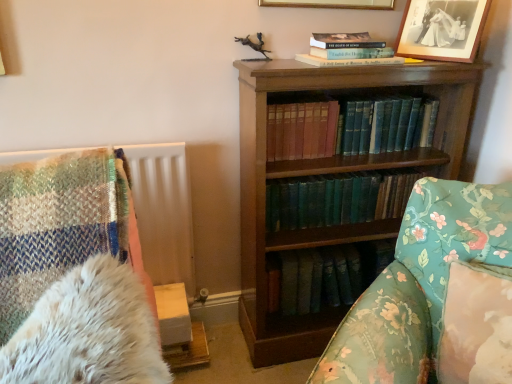
Question: Considering the relative positions of dark green leather bookshelf at center and black matte picture frame at upper right, the second picture frame positioned from the left, in the image provided, is dark green leather bookshelf at center in front of black matte picture frame at upper right, the second picture frame positioned from the left,?

Choices:
 (A) no
 (B) yes

Answer: (B)

Question: From the image's perspective, does dark green leather bookshelf at center appear lower than black matte picture frame at upper right, the second picture frame positioned from the left?

Choices:
 (A) no
 (B) yes

Answer: (B)

Question: Can you confirm if dark green leather bookshelf at center is taller than black matte picture frame at upper right, the first picture frame viewed from the right?

Choices:
 (A) no
 (B) yes

Answer: (B)

Question: Is dark green leather bookshelf at center shorter than black matte picture frame at upper right, the first picture frame viewed from the right?

Choices:
 (A) yes
 (B) no

Answer: (B)

Question: Does dark green leather bookshelf at center touch black matte picture frame at upper right, the first picture frame viewed from the right?

Choices:
 (A) no
 (B) yes

Answer: (A)

Question: Can we say dark green leather bookshelf at center lies outside black matte picture frame at upper right, the second picture frame positioned from the left?

Choices:
 (A) no
 (B) yes

Answer: (B)

Question: Is black matte picture frame at upper right, the first picture frame viewed from the right, facing towards dark green leather bookshelf at center?

Choices:
 (A) no
 (B) yes

Answer: (A)

Question: Is black matte picture frame at upper right, the second picture frame positioned from the left, positioned far away from dark green leather bookshelf at center?

Choices:
 (A) no
 (B) yes

Answer: (A)

Question: Is black matte picture frame at upper right, the second picture frame positioned from the left, bigger than dark green leather bookshelf at center?

Choices:
 (A) yes
 (B) no

Answer: (B)

Question: Is black matte picture frame at upper right, the first picture frame viewed from the right, completely or partially outside of dark green leather bookshelf at center?

Choices:
 (A) yes
 (B) no

Answer: (A)

Question: Is black matte picture frame at upper right, the second picture frame positioned from the left, shorter than dark green leather bookshelf at center?

Choices:
 (A) no
 (B) yes

Answer: (B)

Question: Is black matte picture frame at upper right, the second picture frame positioned from the left, smaller than dark green leather bookshelf at center?

Choices:
 (A) yes
 (B) no

Answer: (A)

Question: Is black matte picture frame at upper right, the second picture frame positioned from the left, wider than teal leather book at center, arranged as the second book when ordered from the bottom?

Choices:
 (A) yes
 (B) no

Answer: (B)